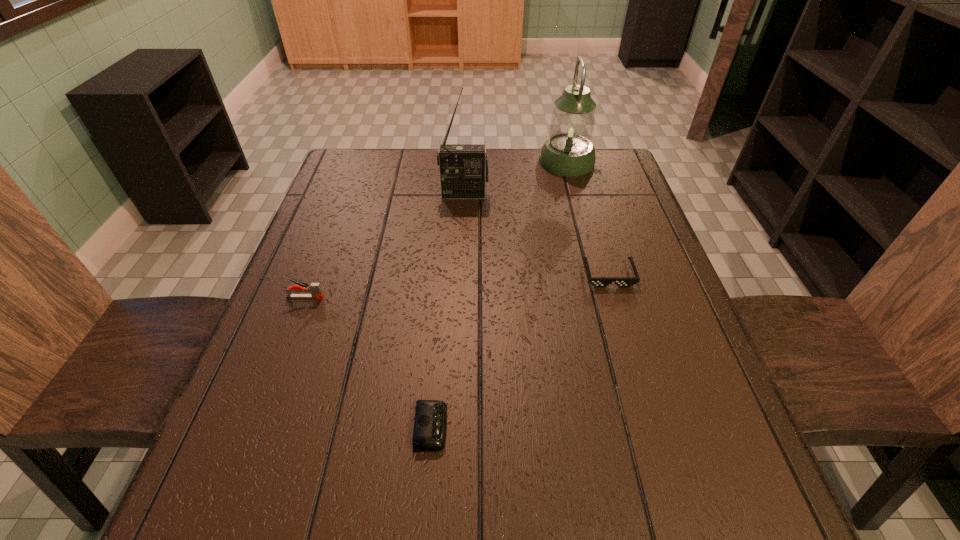
Locate an element on the screen. This screenshot has height=540, width=960. the farthest object is located at coordinates (568, 151).

The image size is (960, 540). Identify the location of radio receiver. (463, 167).

This screenshot has width=960, height=540. In order to click on stapler in this screenshot , I will do `click(315, 289)`.

The width and height of the screenshot is (960, 540). I want to click on the leftmost object, so tap(315, 289).

You are a GUI agent. You are given a task and a screenshot of the screen. Output one action in this format:
    pyautogui.click(x=<x>, y=<y>)
    Task: Click on the sunglasses
    
    Given the screenshot: What is the action you would take?
    click(599, 282)

This screenshot has width=960, height=540. What are the coordinates of `alarm clock` in the screenshot? It's located at (430, 425).

Identify the location of vacant space located 0.060m on the right of the farthest object. The width and height of the screenshot is (960, 540). (613, 162).

Identify the location of vacant space located on the display of the radio receiver. This screenshot has width=960, height=540. click(464, 217).

Identify the location of free location located 0.350m on the handle side of the stapler. The height and width of the screenshot is (540, 960). (481, 297).

Find the location of a particular element. The width and height of the screenshot is (960, 540). free space located on the front-facing side of the sunglasses is located at coordinates (651, 419).